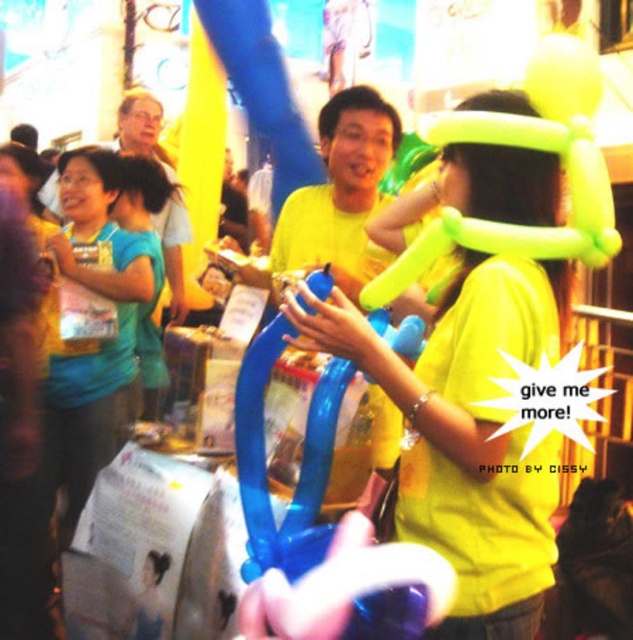
Between point (477, 600) and point (346, 104), which one is positioned in front?

Point (477, 600) is more forward.

Is neon yellow balloon at center shorter than yellow matte balloon at center?

No, neon yellow balloon at center is not shorter than yellow matte balloon at center.

Which is in front, point (546, 307) or point (346, 243)?

Point (546, 307)

The width and height of the screenshot is (633, 640). Identify the location of neon yellow balloon at center. (468, 435).

Who is positioned more to the right, neon yellow balloon at center or blue matte shirt at center?

neon yellow balloon at center

This screenshot has width=633, height=640. Find the location of `neon yellow balloon at center`. neon yellow balloon at center is located at coordinates (468, 435).

Who is more forward, (422, 406) or (84, 404)?

Point (422, 406)

Image resolution: width=633 pixels, height=640 pixels. What are the coordinates of `neon yellow balloon at center` in the screenshot? It's located at (468, 435).

Is blue matte shirt at center bigger than yellow matte balloon at center?

Correct, blue matte shirt at center is larger in size than yellow matte balloon at center.

Measure the distance between point (77, 468) and camera.

A distance of 23.80 meters exists between point (77, 468) and camera.

Locate an element on the screen. The width and height of the screenshot is (633, 640). blue matte shirt at center is located at coordinates (94, 340).